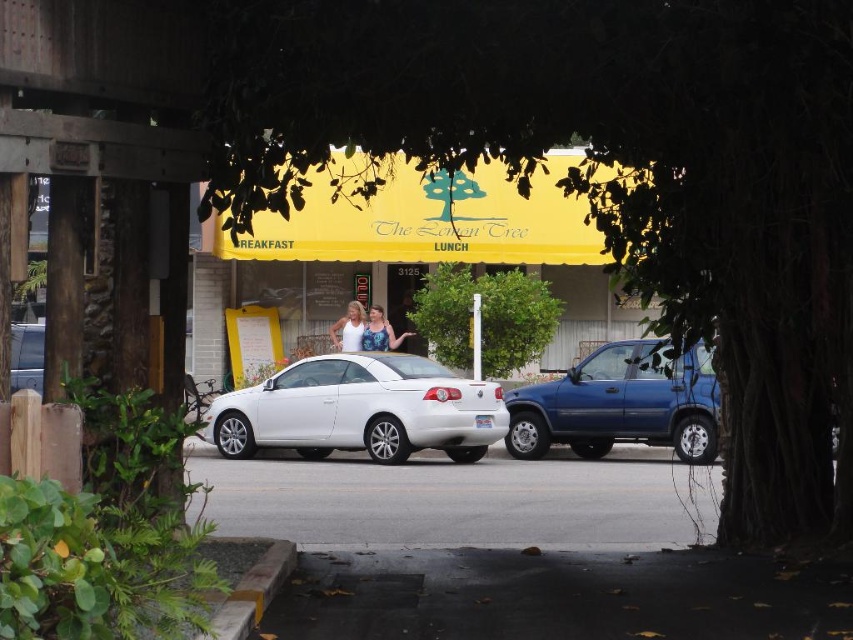
Question: Which point appears farthest from the camera in this image?

Choices:
 (A) (259, 417)
 (B) (337, 323)

Answer: (B)

Question: Is green leafy bush at center positioned behind white matte tank top at center?

Choices:
 (A) yes
 (B) no

Answer: (B)

Question: Which point is closer to the camera taking this photo?

Choices:
 (A) (706, 461)
 (B) (271, 378)

Answer: (A)

Question: Does white glossy convertible at center have a lesser width compared to blue denim shirt at center?

Choices:
 (A) yes
 (B) no

Answer: (B)

Question: Among these points, which one is nearest to the camera?

Choices:
 (A) click(380, 346)
 (B) click(337, 344)
 (C) click(548, 8)

Answer: (C)

Question: Can you confirm if blue denim shirt at center is wider than white matte tank top at center?

Choices:
 (A) no
 (B) yes

Answer: (B)